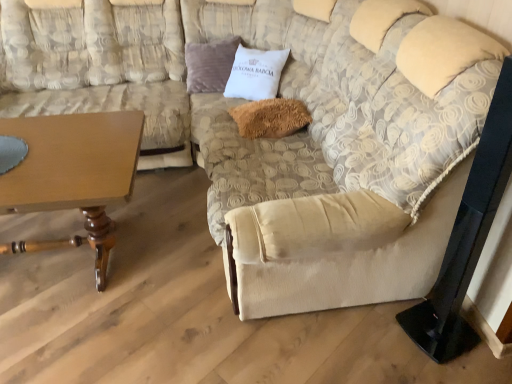
Question: Is beige fabric couch at left facing towards velvet purple pillow at upper center, which ranks as the 2th pillow in front-to-back order?

Choices:
 (A) no
 (B) yes

Answer: (A)

Question: Considering the relative sizes of beige fabric couch at left and velvet purple pillow at upper center, which is the 1th pillow from back to front, in the image provided, is beige fabric couch at left smaller than velvet purple pillow at upper center, which is the 1th pillow from back to front,?

Choices:
 (A) no
 (B) yes

Answer: (A)

Question: Can you confirm if beige fabric couch at left is thinner than velvet purple pillow at upper center, arranged as the second pillow when ordered from the bottom?

Choices:
 (A) yes
 (B) no

Answer: (B)

Question: From the image's perspective, does beige fabric couch at left appear lower than velvet purple pillow at upper center, which ranks as the 2th pillow in front-to-back order?

Choices:
 (A) yes
 (B) no

Answer: (A)

Question: Are beige fabric couch at left and velvet purple pillow at upper center, which is the 1th pillow from back to front, far apart?

Choices:
 (A) no
 (B) yes

Answer: (A)

Question: Considering the relative positions of beige fabric couch at left and velvet purple pillow at upper center, the first pillow from the left, in the image provided, is beige fabric couch at left to the left of velvet purple pillow at upper center, the first pillow from the left, from the viewer's perspective?

Choices:
 (A) no
 (B) yes

Answer: (B)

Question: Can you confirm if fuzzy brown pillow at center, the second pillow viewed from the top, is thinner than wooden table at lower left?

Choices:
 (A) no
 (B) yes

Answer: (B)

Question: Is fuzzy brown pillow at center, the second pillow viewed from the top, positioned with its back to wooden table at lower left?

Choices:
 (A) yes
 (B) no

Answer: (B)

Question: From the image's perspective, would you say fuzzy brown pillow at center, which is counted as the second pillow, starting from the back, is shown under wooden table at lower left?

Choices:
 (A) no
 (B) yes

Answer: (A)

Question: Is fuzzy brown pillow at center, which ranks as the 1th pillow in bottom-to-top order, closer to camera compared to wooden table at lower left?

Choices:
 (A) no
 (B) yes

Answer: (A)

Question: Does fuzzy brown pillow at center, which is the first pillow in right-to-left order, contain wooden table at lower left?

Choices:
 (A) yes
 (B) no

Answer: (B)

Question: From a real-world perspective, does fuzzy brown pillow at center, placed as the 1th pillow when sorted from front to back, sit lower than wooden table at lower left?

Choices:
 (A) yes
 (B) no

Answer: (B)

Question: Is velvet purple pillow at upper center, which is the 1th pillow from back to front, taller than fuzzy brown pillow at center, which is counted as the second pillow, starting from the back?

Choices:
 (A) no
 (B) yes

Answer: (B)